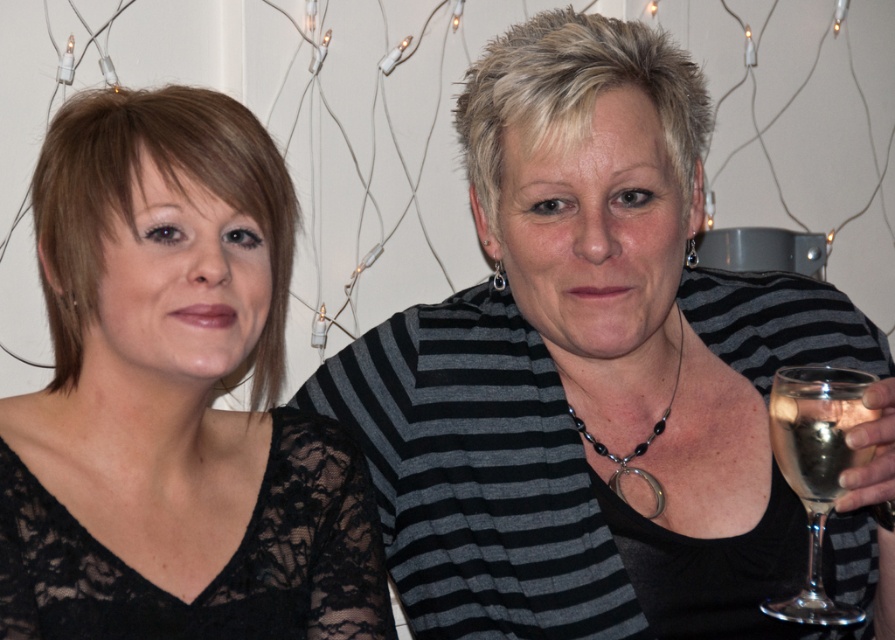
You are a photographer adjusting your camera settings to focus on the black lace top at upper right and the black beaded necklace at center. Which object should you focus on first if you want to capture both in sharp detail?

The black lace top at upper right should be focused on first because it is located above the black beaded necklace at center, allowing the photographer to adjust the focus from top to bottom for both objects.

You are a photographer setting up for a photoshoot. You need to position a light source to the left of the black lace dress at left and to the right of the clear glass at right. Is this possible given their current positions?

The black lace dress at left is to the left of the clear glass at right, so placing the light source to the left of the black lace dress at left and to the right of the clear glass at right is not possible because the clear glass at right is already to the right of the black lace dress at left.

You are a photographer setting up a shoot in the room described. You notice the black lace top at upper right and the black beaded necklace at center. Which object is closer to the camera lens based on their positions?

The black lace top at upper right is in front of the black beaded necklace at center, so it is closer to the camera lens.